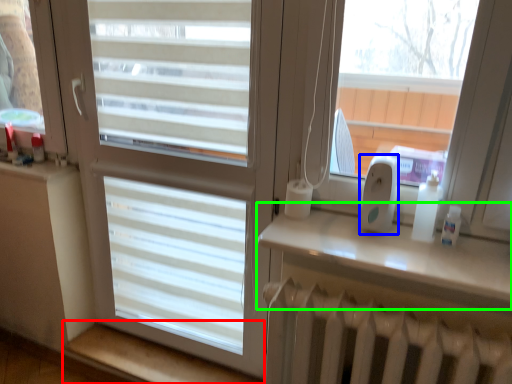
Question: Which is farther away from window sill (highlighted by a red box)? ipod (highlighted by a blue box) or window sill (highlighted by a green box)?

Choices:
 (A) ipod
 (B) window sill

Answer: (A)